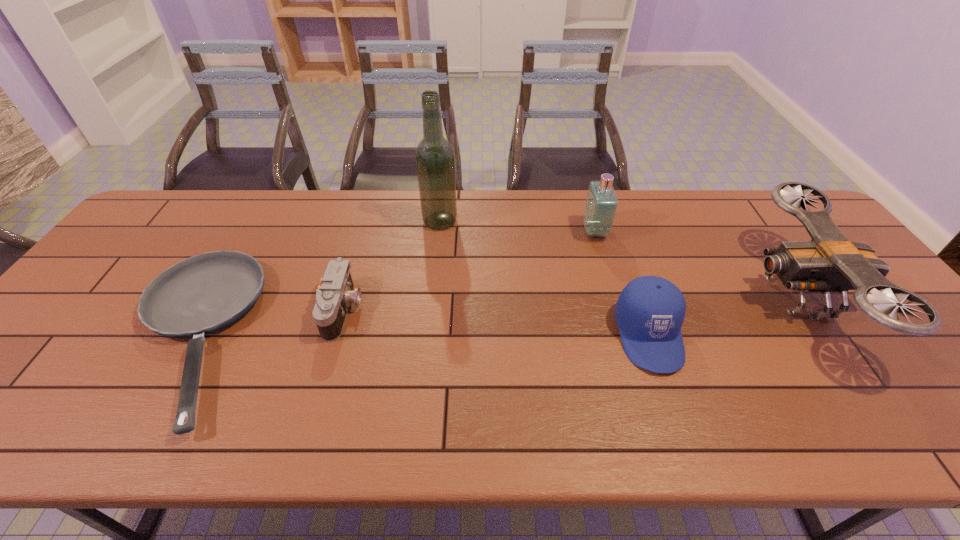
I want to click on drone situated at the far edge, so click(x=830, y=262).

Where is `perfume that is at the far edge`? This screenshot has height=540, width=960. perfume that is at the far edge is located at coordinates (601, 205).

I want to click on object at the near edge, so click(202, 294).

Image resolution: width=960 pixels, height=540 pixels. What are the coordinates of `object that is positioned at the right edge` in the screenshot? It's located at (830, 262).

Locate an element on the screen. The height and width of the screenshot is (540, 960). object that is at the far right corner is located at coordinates (830, 262).

The height and width of the screenshot is (540, 960). In the image, there is a desktop. What are the coordinates of `vacant space at the far edge` in the screenshot? It's located at (746, 214).

You are a GUI agent. You are given a task and a screenshot of the screen. Output one action in this format:
    pyautogui.click(x=<x>, y=<y>)
    Task: Click on the free space at the near edge of the desktop
    
    Given the screenshot: What is the action you would take?
    pyautogui.click(x=423, y=410)

Locate an element on the screen. free spot between the tallest object and the perfume is located at coordinates (517, 226).

The width and height of the screenshot is (960, 540). I want to click on vacant area between the rightmost object and the perfume, so click(696, 265).

At what (x,y) coordinates should I click in order to perform the action: click on free space between the fifth object from right to left and the fourth tallest object. Please return your answer as a coordinate pair (x, y). Looking at the image, I should click on (496, 322).